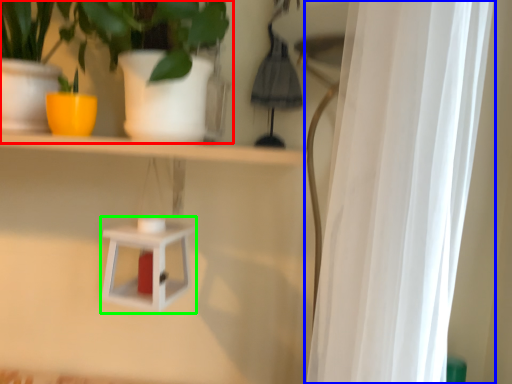
Question: Considering the real-world distances, which object is closest to houseplant (highlighted by a red box)? curtain (highlighted by a blue box) or shelf (highlighted by a green box).

Choices:
 (A) curtain
 (B) shelf

Answer: (B)